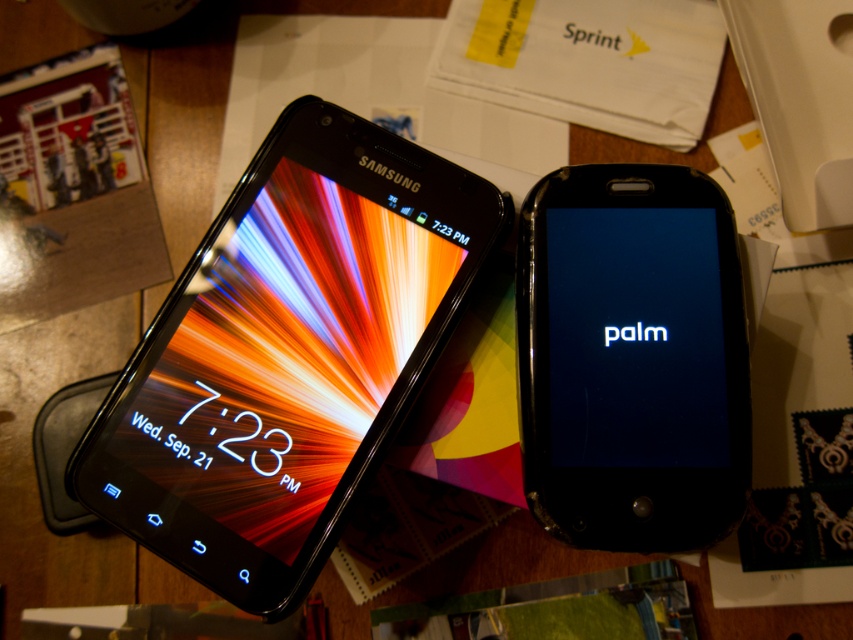
You are organizing items on a desk and need to place a new item between the matte black smartphone at center and the black glossy phone at center. Is there enough vertical space between them to fit a 1.5 cm tall object?

The matte black smartphone at center is above the black glossy phone at center, but the exact vertical distance between them isn

You are organizing a tech showcase and need to place two phones, the matte black smartphone at center and the black glossy phone at center, on a display stand. The stand has a single shelf that can only hold items arranged in a straight line. If you want to maintain their current side by side arrangement as shown in the image, which phone should be placed to the left to match the original setup?

The matte black smartphone at center should be placed to the left of the black glossy phone at center to maintain their original side by side arrangement as shown in the image.